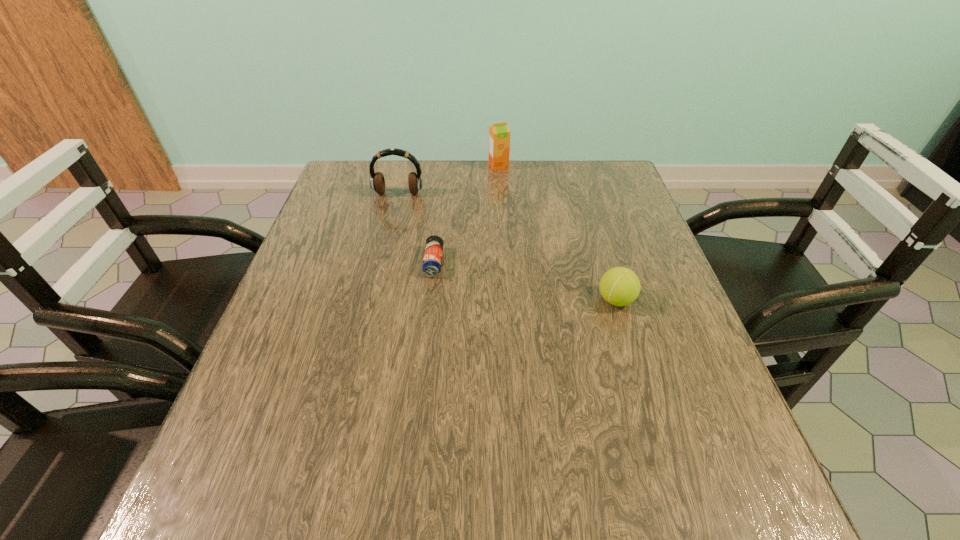
The height and width of the screenshot is (540, 960). In the image, there is a desktop. Find the location of `vacant space at the near left corner`. vacant space at the near left corner is located at coordinates (185, 519).

Find the location of a particular element. vacant region at the far right corner of the desktop is located at coordinates (616, 168).

Find the location of `blank region between the second object from right to left and the headset`. blank region between the second object from right to left and the headset is located at coordinates (448, 180).

Find the location of a particular element. unoccupied area between the farthest object and the tennis ball is located at coordinates (557, 233).

The width and height of the screenshot is (960, 540). What are the coordinates of `free space between the headset and the orange juice` in the screenshot? It's located at pyautogui.click(x=448, y=180).

Locate an element on the screen. The width and height of the screenshot is (960, 540). blank region between the orange juice and the rightmost object is located at coordinates (557, 233).

The height and width of the screenshot is (540, 960). I want to click on free space that is in between the third nearest object and the tennis ball, so click(x=507, y=247).

Where is `vacant space that's between the orange juice and the second shortest object`? vacant space that's between the orange juice and the second shortest object is located at coordinates (557, 233).

Locate an element on the screen. The height and width of the screenshot is (540, 960). unoccupied area between the beer can and the orange juice is located at coordinates (467, 214).

You are a GUI agent. You are given a task and a screenshot of the screen. Output one action in this format:
    pyautogui.click(x=<x>, y=<y>)
    Task: Click on the free space between the third object from right to left and the nearest object
    This screenshot has width=960, height=540.
    Given the screenshot: What is the action you would take?
    pyautogui.click(x=525, y=281)